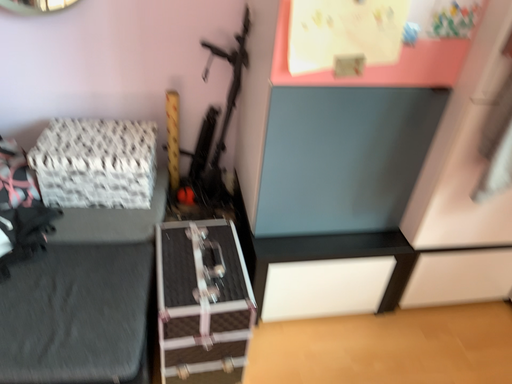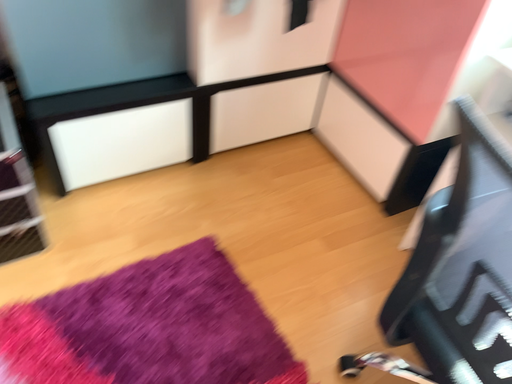
Question: How did the camera likely rotate when shooting the video?

Choices:
 (A) rotated left
 (B) rotated right

Answer: (B)